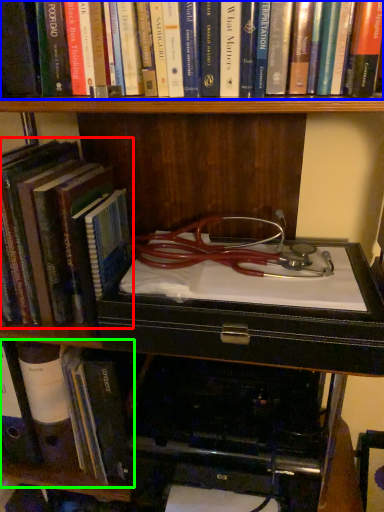
Question: Considering the real-world distances, which object is farthest from book (highlighted by a red box)? book (highlighted by a blue box) or book (highlighted by a green box)?

Choices:
 (A) book
 (B) book

Answer: (A)